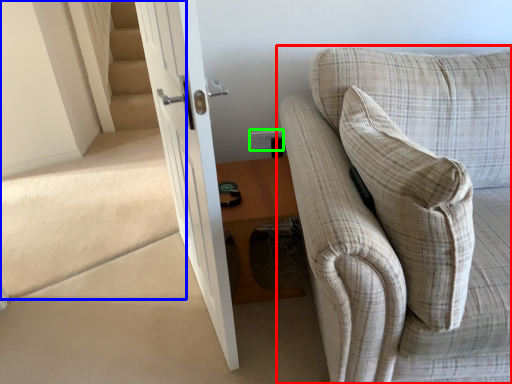
Question: Which is farther away from studio couch (highlighted by a red box)? stairwell (highlighted by a blue box) or electric outlet (highlighted by a green box)?

Choices:
 (A) stairwell
 (B) electric outlet

Answer: (A)